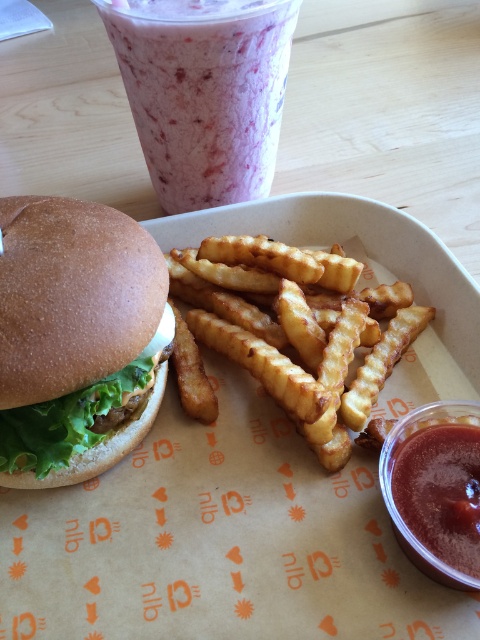
Is golden crispy fries at center positioned before smooth tomato sauce at lower right?

No, it is behind smooth tomato sauce at lower right.

Between point (233, 296) and point (424, 467), which one is positioned in front?

Positioned in front is point (424, 467).

Between point (365, 340) and point (418, 563), which one is positioned behind?

Positioned behind is point (365, 340).

Locate an element on the screen. The image size is (480, 640). golden crispy fries at center is located at coordinates (299, 326).

Does brown matte burger at left appear on the left side of smooth tomato sauce at lower right?

Yes, brown matte burger at left is to the left of smooth tomato sauce at lower right.

Consider the image. Who is more forward, (95, 230) or (405, 456)?

Positioned in front is point (95, 230).

I want to click on brown matte burger at left, so click(76, 337).

Can you confirm if brown matte burger at left is bigger than pink smoothie at upper center?

No, brown matte burger at left is not bigger than pink smoothie at upper center.

At what (x,y) coordinates should I click in order to perform the action: click on brown matte burger at left. Please return your answer as a coordinate pair (x, y). Looking at the image, I should click on [76, 337].